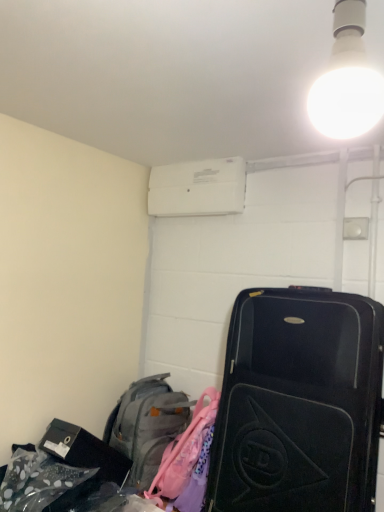
Identify the location of gray fabric backpack at lower left. The height and width of the screenshot is (512, 384). (147, 425).

Describe the element at coordinates (198, 188) in the screenshot. This screenshot has height=512, width=384. I see `white plastic air conditioner at upper center` at that location.

Locate an element on the screen. This screenshot has width=384, height=512. gray fabric backpack at lower left is located at coordinates (147, 425).

Is white plastic air conditioner at upper center at the right side of black hardshell suitcase at right?

Incorrect, white plastic air conditioner at upper center is not on the right side of black hardshell suitcase at right.

Identify the location of air conditioning above the black hardshell suitcase at right (from the image's perspective). (198, 188).

Could you measure the distance between white plastic air conditioner at upper center and black hardshell suitcase at right?

white plastic air conditioner at upper center is 30.35 inches away from black hardshell suitcase at right.

Is white plastic air conditioner at upper center in front of or behind black hardshell suitcase at right in the image?

Clearly, white plastic air conditioner at upper center is behind black hardshell suitcase at right.

Looking at this image, from the image's perspective, which object appears higher, white glossy bulb at upper right or gray fabric backpack at lower left?

white glossy bulb at upper right, from the image's perspective.

Looking at the image, does white glossy bulb at upper right seem bigger or smaller compared to gray fabric backpack at lower left?

Clearly, white glossy bulb at upper right is smaller in size than gray fabric backpack at lower left.

Is white glossy bulb at upper right not near gray fabric backpack at lower left?

That's right, there is a large distance between white glossy bulb at upper right and gray fabric backpack at lower left.

Locate an element on the screen. This screenshot has height=512, width=384. air conditioning below the white glossy bulb at upper right (from the image's perspective) is located at coordinates (198, 188).

Does white glossy bulb at upper right lie behind white plastic air conditioner at upper center?

No, white glossy bulb at upper right is closer to the camera.

From a real-world perspective, which object stands above the other?

white plastic air conditioner at upper center, from a real-world perspective.

Is white glossy bulb at upper right next to white plastic air conditioner at upper center and touching it?

No, white glossy bulb at upper right is not in contact with white plastic air conditioner at upper center.

From a real-world perspective, is gray fabric backpack at lower left beneath white glossy bulb at upper right?

Correct, in the physical world, gray fabric backpack at lower left is lower than white glossy bulb at upper right.

Which object is closer to the camera taking this photo, gray fabric backpack at lower left or white glossy bulb at upper right?

white glossy bulb at upper right is closer to the camera.

Is gray fabric backpack at lower left to the left or to the right of white glossy bulb at upper right in the image?

gray fabric backpack at lower left is positioned on white glossy bulb at upper right's left side.

Is gray fabric backpack at lower left inside or outside of white glossy bulb at upper right?

gray fabric backpack at lower left is not inside white glossy bulb at upper right, it's outside.

In the scene shown: Which object is positioned more to the left, black hardshell suitcase at right or gray fabric backpack at lower left?

gray fabric backpack at lower left is more to the left.

Is gray fabric backpack at lower left at the back of black hardshell suitcase at right?

No, black hardshell suitcase at right is not facing the opposite direction of gray fabric backpack at lower left.

From a real-world perspective, is black hardshell suitcase at right beneath gray fabric backpack at lower left?

No.

Are white glossy bulb at upper right and black hardshell suitcase at right located far from each other?

That's right, there is a large distance between white glossy bulb at upper right and black hardshell suitcase at right.

From a real-world perspective, is white glossy bulb at upper right positioned above or below black hardshell suitcase at right?

Clearly, from a real-world perspective, white glossy bulb at upper right is above black hardshell suitcase at right.

Is the depth of white glossy bulb at upper right greater than that of black hardshell suitcase at right?

No, the depth of white glossy bulb at upper right is less than that of black hardshell suitcase at right.

Can you confirm if black hardshell suitcase at right is thinner than white glossy bulb at upper right?

In fact, black hardshell suitcase at right might be wider than white glossy bulb at upper right.

Considering the relative positions of black hardshell suitcase at right and white glossy bulb at upper right in the image provided, is black hardshell suitcase at right in front of white glossy bulb at upper right?

No, black hardshell suitcase at right is further to the viewer.

From a real-world perspective, which is physically above, black hardshell suitcase at right or white glossy bulb at upper right?

From a 3D spatial view, white glossy bulb at upper right is above.

Considering the points (281, 413) and (354, 127), which point is in front, point (281, 413) or point (354, 127)?

Positioned in front is point (354, 127).

I want to click on suitcase that appears below the white plastic air conditioner at upper center (from a real-world perspective), so click(x=299, y=403).

Where is `luggage and bags below the white glossy bulb at upper right (from the image's perspective)`? This screenshot has height=512, width=384. luggage and bags below the white glossy bulb at upper right (from the image's perspective) is located at coordinates (147, 425).

From the image, which object appears to be nearer to black hardshell suitcase at right, gray fabric backpack at lower left or white plastic air conditioner at upper center?

The object closer to black hardshell suitcase at right is gray fabric backpack at lower left.

Estimate the real-world distances between objects in this image. Which object is further from gray fabric backpack at lower left, white glossy bulb at upper right or white plastic air conditioner at upper center?

white glossy bulb at upper right is further to gray fabric backpack at lower left.

Based on their spatial positions, is black hardshell suitcase at right or white plastic air conditioner at upper center closer to white glossy bulb at upper right?

The object closer to white glossy bulb at upper right is black hardshell suitcase at right.

Based on their spatial positions, is white glossy bulb at upper right or black hardshell suitcase at right closer to white plastic air conditioner at upper center?

black hardshell suitcase at right is positioned closer to the anchor white plastic air conditioner at upper center.

Considering their positions, is white plastic air conditioner at upper center positioned further to white glossy bulb at upper right than gray fabric backpack at lower left?

Based on the image, gray fabric backpack at lower left appears to be further to white glossy bulb at upper right.

From the image, which object appears to be nearer to white glossy bulb at upper right, white plastic air conditioner at upper center or black hardshell suitcase at right?

Among the two, black hardshell suitcase at right is located nearer to white glossy bulb at upper right.

Based on the photo, considering their positions, is gray fabric backpack at lower left positioned further to white glossy bulb at upper right than white plastic air conditioner at upper center?

The object further to white glossy bulb at upper right is gray fabric backpack at lower left.

Based on the photo, based on their spatial positions, is white glossy bulb at upper right or black hardshell suitcase at right closer to gray fabric backpack at lower left?

Among the two, black hardshell suitcase at right is located nearer to gray fabric backpack at lower left.

Locate an element on the screen. This screenshot has height=512, width=384. suitcase located between white glossy bulb at upper right and white plastic air conditioner at upper center in the depth direction is located at coordinates (299, 403).

This screenshot has height=512, width=384. Identify the location of suitcase between white plastic air conditioner at upper center and gray fabric backpack at lower left in the vertical direction. (299, 403).

Image resolution: width=384 pixels, height=512 pixels. I want to click on luggage and bags located between white glossy bulb at upper right and white plastic air conditioner at upper center in the depth direction, so click(x=147, y=425).

Where is `suitcase positioned between white glossy bulb at upper right and gray fabric backpack at lower left from near to far`? This screenshot has width=384, height=512. suitcase positioned between white glossy bulb at upper right and gray fabric backpack at lower left from near to far is located at coordinates [x=299, y=403].